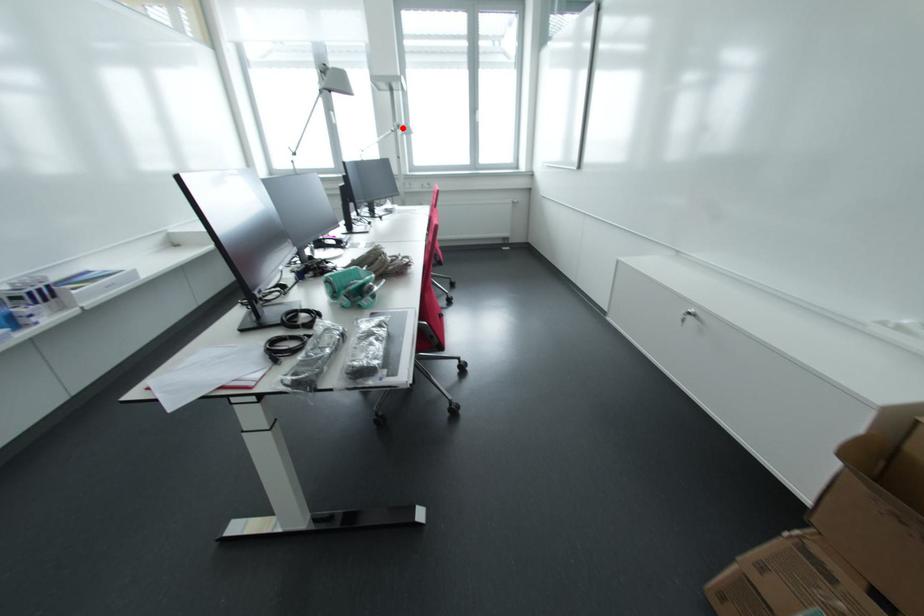
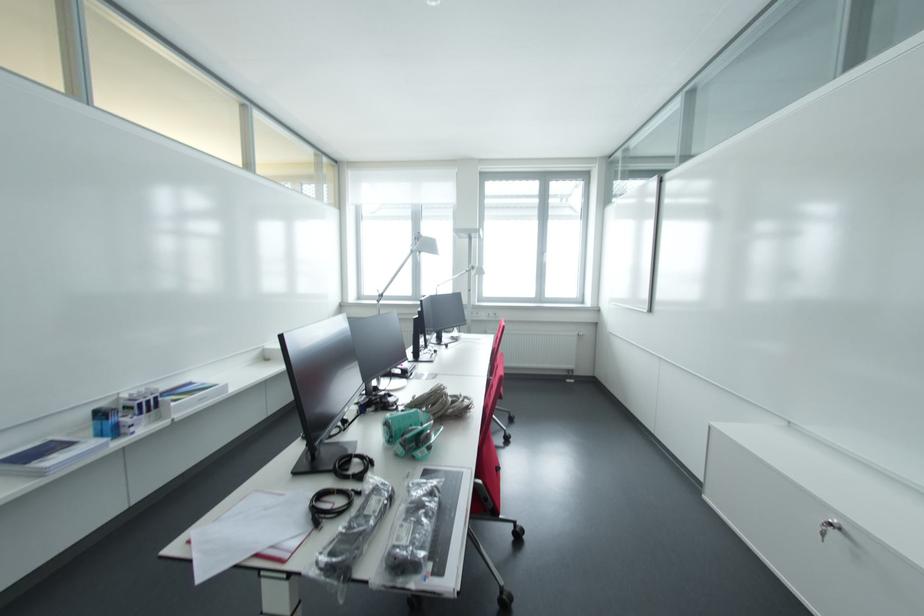
The point at the highlighted location is marked in the first image. Where is the corresponding point in the second image?

(476, 270)